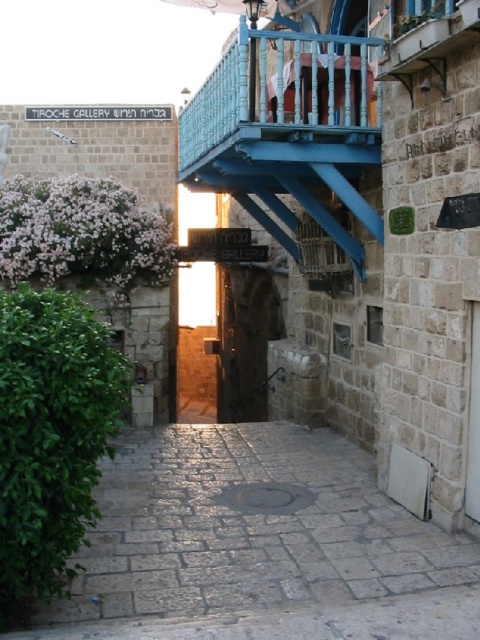
You are a delivery person trying to navigate through the stone paved alley at center. There is a blue painted wood balcony at upper center above you. Can you safely pass underneath without hitting your head?

The stone paved alley at center is located below the blue painted wood balcony at upper center, so there is sufficient vertical clearance for you to pass underneath safely.

You are standing at the entrance of the Tiroche Gallery alleyway and see two points marked on the ground. One is at coordinate point (156, 516) and the other at point (352, 131). If you want to walk towards the point that is closer to you, which coordinate should you head towards?

You should head towards point (156, 516) because it is in front of point (352, 131), meaning it is closer to your current position at the entrance.